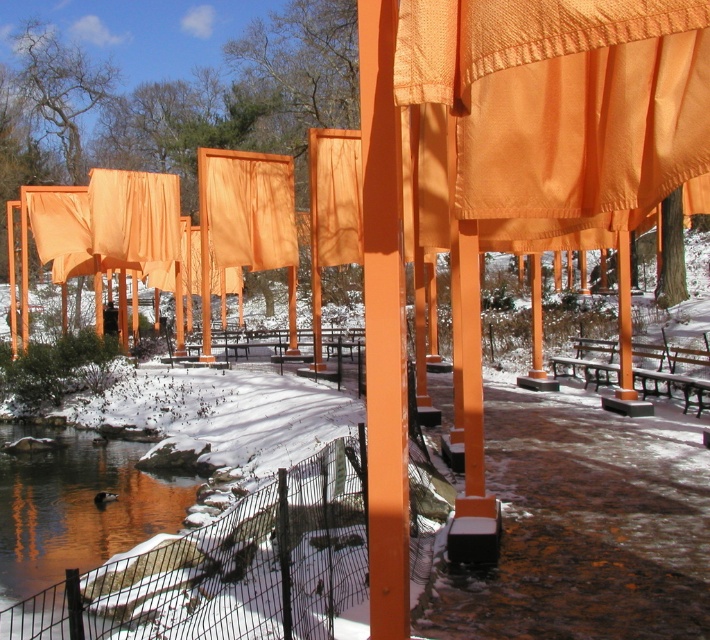
Between orange satin curtain at center and orange fabric curtain at center, which one appears on the right side from the viewer's perspective?

orange satin curtain at center

Between orange satin curtain at center and orange fabric curtain at center, which one has less height?

With less height is orange satin curtain at center.

Locate an element on the screen. This screenshot has width=710, height=640. orange satin curtain at center is located at coordinates (562, 108).

At what (x,y) coordinates should I click in order to perform the action: click on orange satin curtain at center. Please return your answer as a coordinate pair (x, y). Looking at the image, I should click on (562, 108).

Can you confirm if smooth water at lower left is shorter than orange fabric curtain at center?

Indeed, smooth water at lower left has a lesser height compared to orange fabric curtain at center.

Who is taller, smooth water at lower left or orange fabric curtain at center?

orange fabric curtain at center

Where is `smooth water at lower left`? smooth water at lower left is located at coordinates [76, 506].

Can you confirm if orange satin curtain at center is bigger than smooth water at lower left?

No, orange satin curtain at center is not bigger than smooth water at lower left.

Does point (577, 134) come in front of point (27, 564)?

Yes.

Identify the location of orange satin curtain at center. The image size is (710, 640). (562, 108).